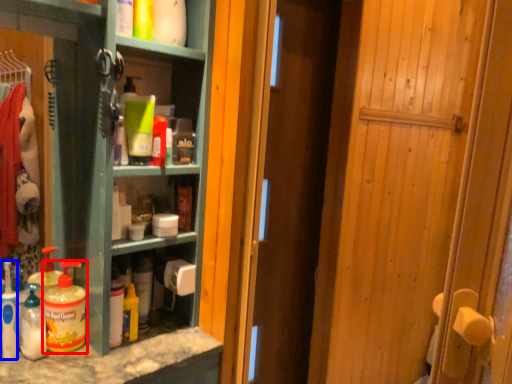
Question: Which object appears closest to the camera in this image, bottle (highlighted by a red box) or cleaning product (highlighted by a blue box)?

Choices:
 (A) bottle
 (B) cleaning product

Answer: (B)